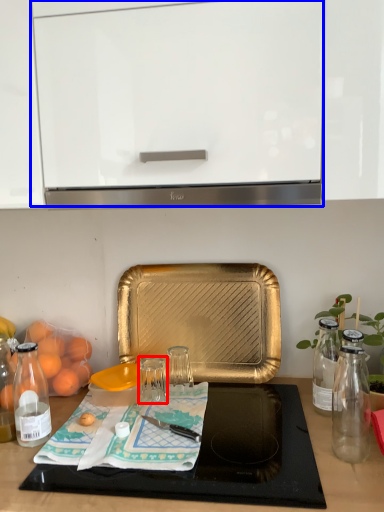
Question: Which object is further to the camera taking this photo, glass jar (highlighted by a red box) or cabinetry (highlighted by a blue box)?

Choices:
 (A) glass jar
 (B) cabinetry

Answer: (A)